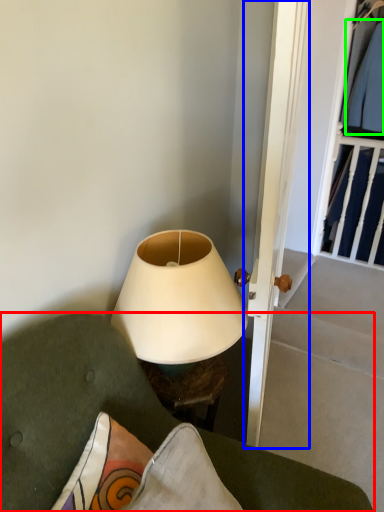
Question: Considering the real-world distances, which object is farthest from furniture (highlighted by a red box)? door (highlighted by a blue box) or clothing (highlighted by a green box)?

Choices:
 (A) door
 (B) clothing

Answer: (B)